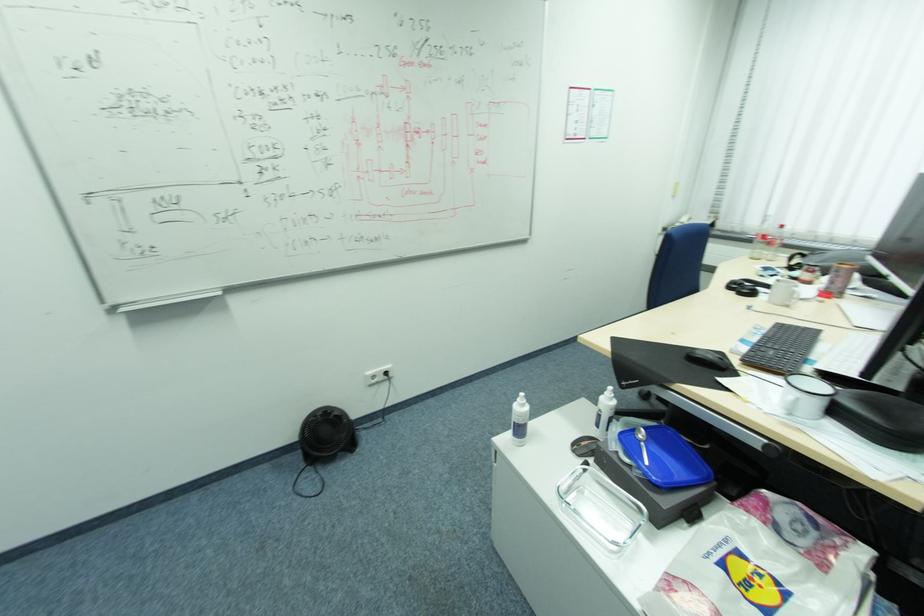
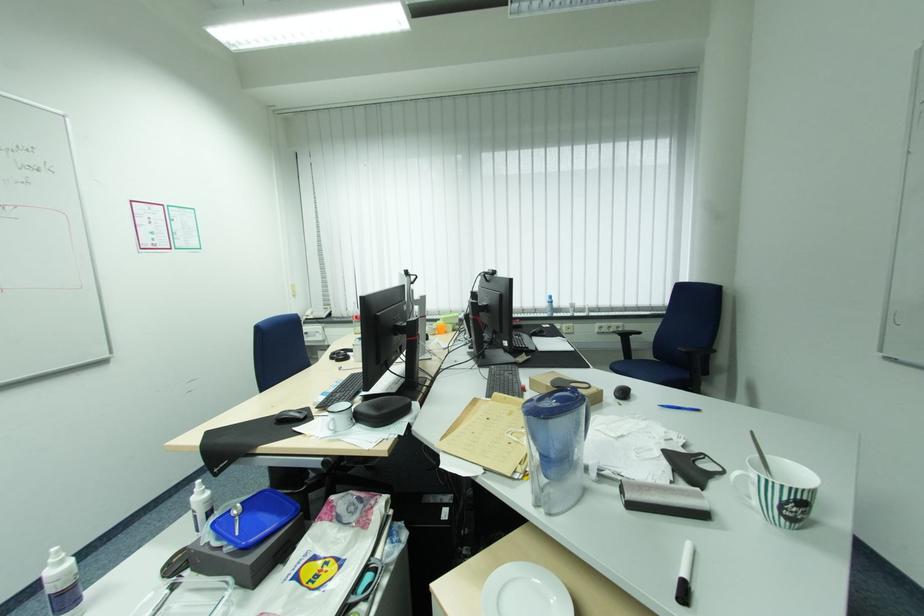
Question: The images are taken continuously from a first-person perspective. In which direction is your viewpoint rotating?

Choices:
 (A) Left
 (B) Right
 (C) Up
 (D) Down

Answer: (B)